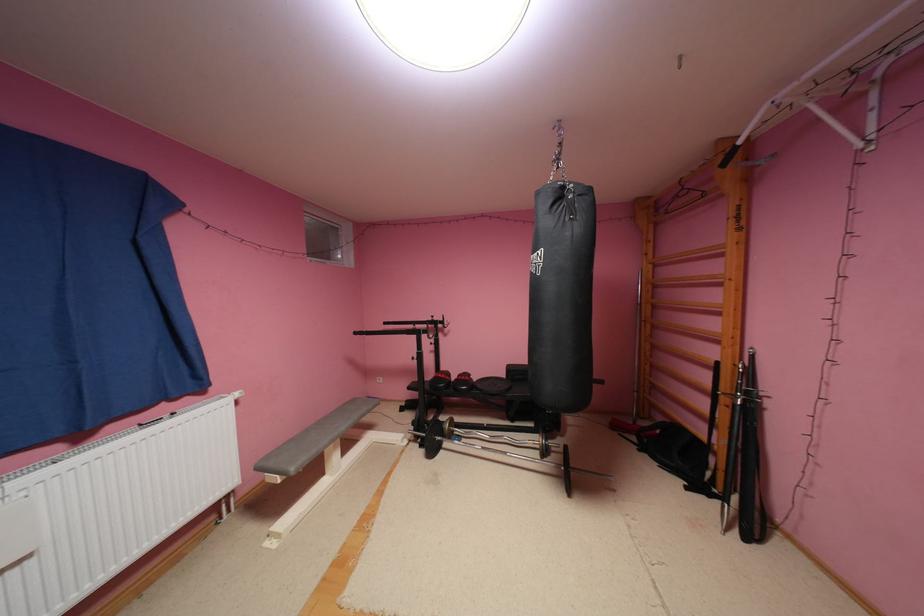
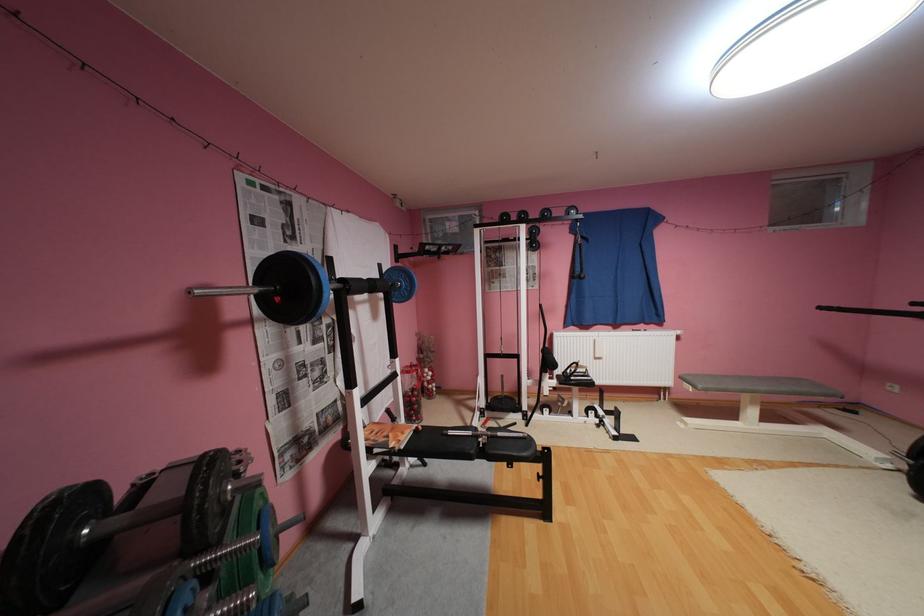
In the second image, find the point that corresponds to pixel 332 474 in the first image.

(746, 419)